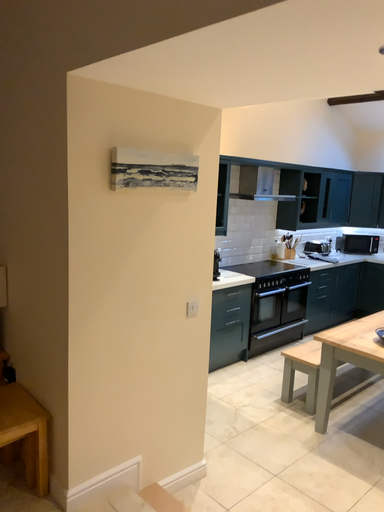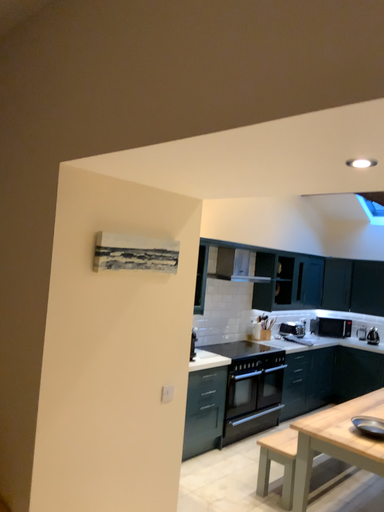
Question: Which way did the camera rotate in the video?

Choices:
 (A) rotated downward
 (B) rotated upward

Answer: (B)